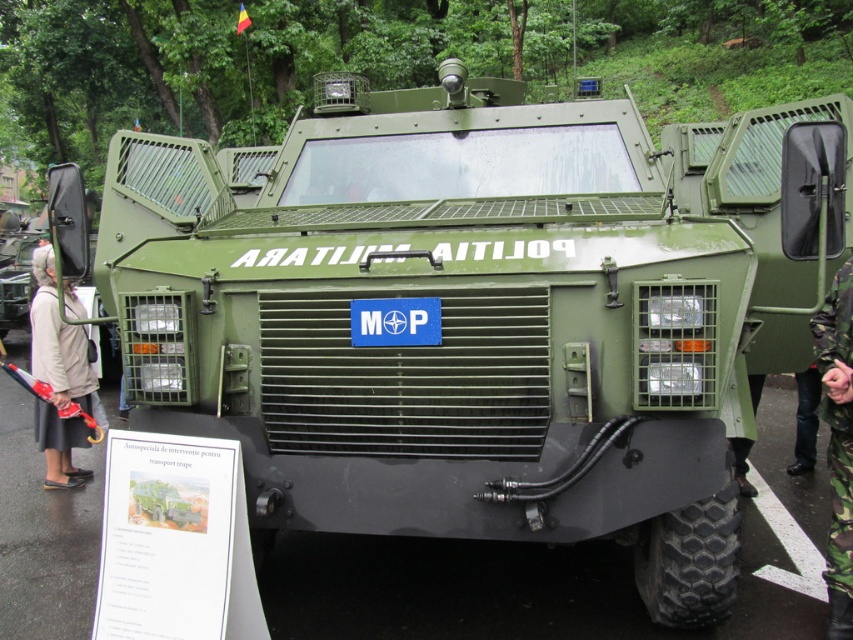
Is beige fabric coat at left above camouflage fabric uniform at right?

Correct, beige fabric coat at left is located above camouflage fabric uniform at right.

Is point (55, 417) positioned before point (816, 340)?

No, (55, 417) is behind (816, 340).

This screenshot has height=640, width=853. What are the coordinates of `beige fabric coat at left` in the screenshot? It's located at (57, 376).

Identify the location of beige fabric coat at left. (57, 376).